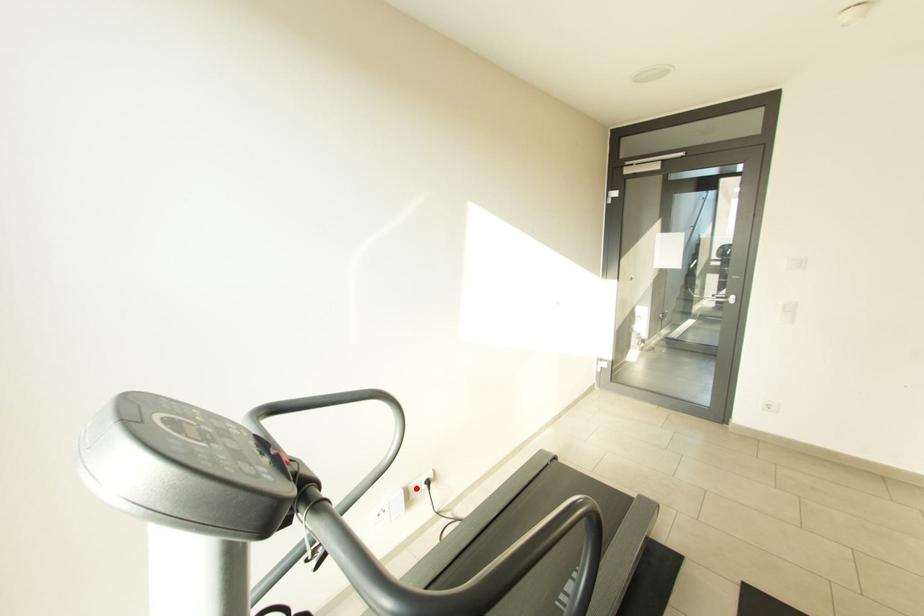
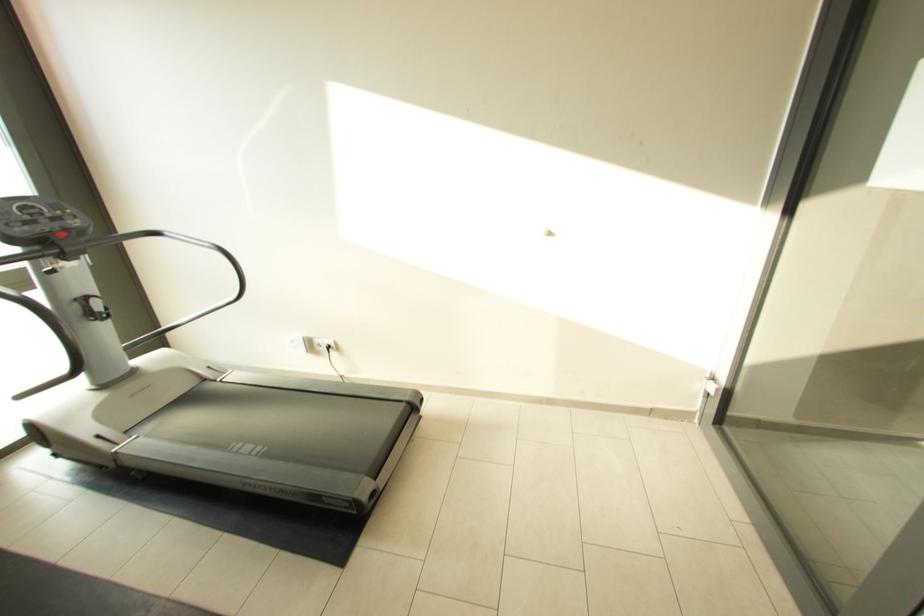
Find the pixel in the second image that matches the highlighted location in the first image.

(322, 342)